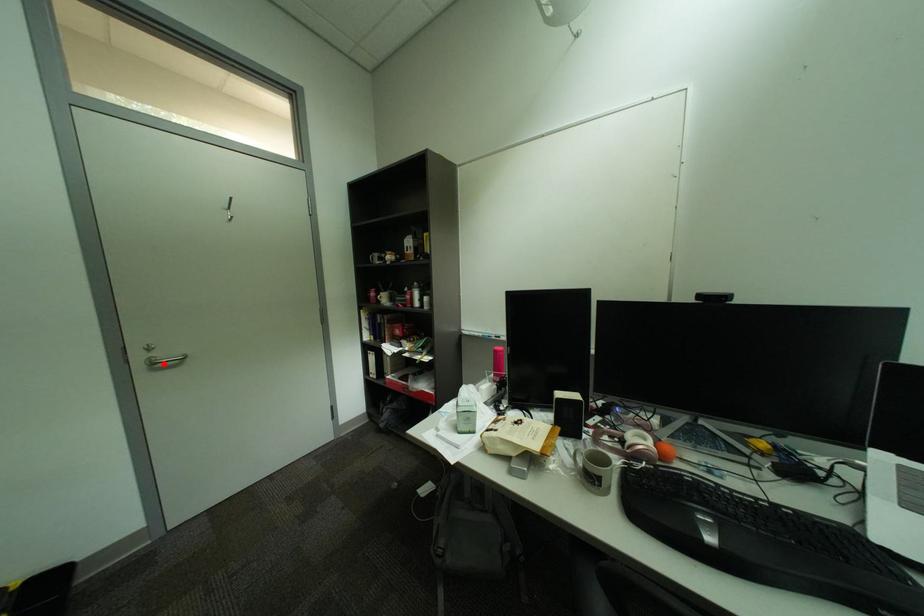
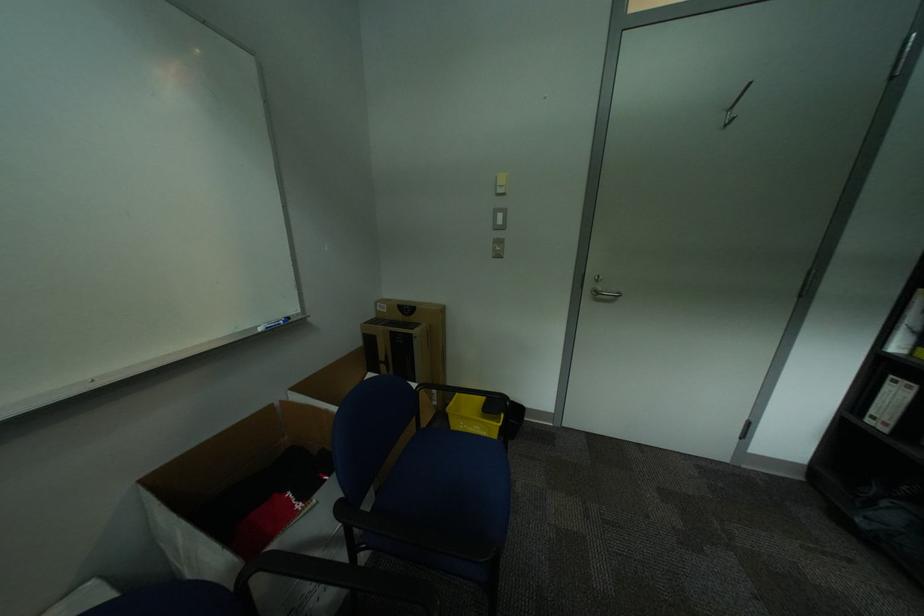
In the second image, find the point that corresponds to the highlighted location in the first image.

(606, 294)